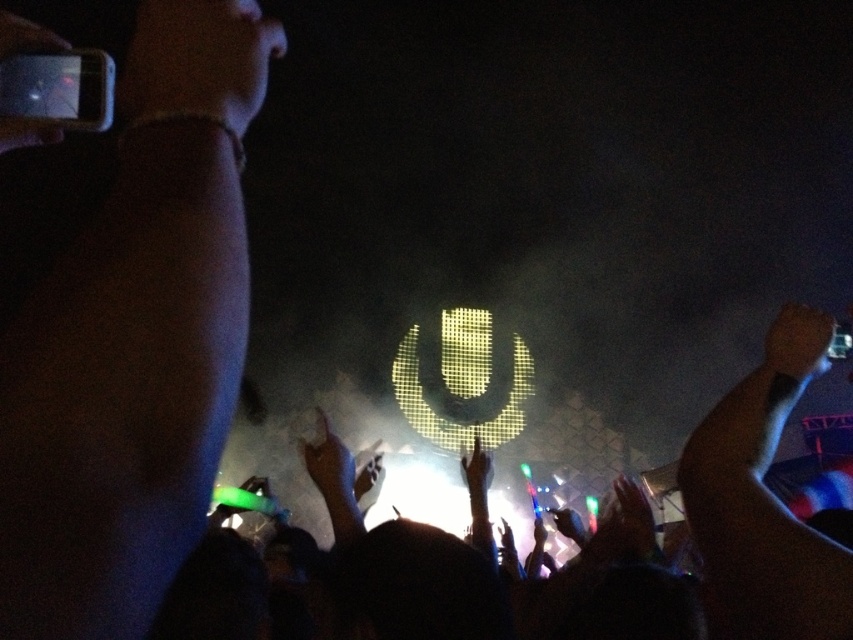
You are a photographer trying to capture a clear shot of the stage. There is a matte black hand at upper right in your viewfinder. Based on its position, can you estimate where this hand is located relative to the center of the image?

The matte black hand at upper right is located at coordinates approximately 54 percent along the horizontal axis and 94 percent along the vertical axis from the bottom left corner of the image, meaning it is positioned near the upper right corner, far from the center.

You are a photographer at the concert. You want to take a photo of the illuminated microphone logo in the background without any foreground obstruction. The point where the matte black hand at upper right is located is at point (798, 342). Is there any part of the matte black hand at upper right blocking the view of the microphone logo at that point?

The matte black hand at upper right is located at point (798, 342). Since the logo is in the background and the hand is in the foreground, the matte black hand at upper right would block the view of the microphone logo at that point.